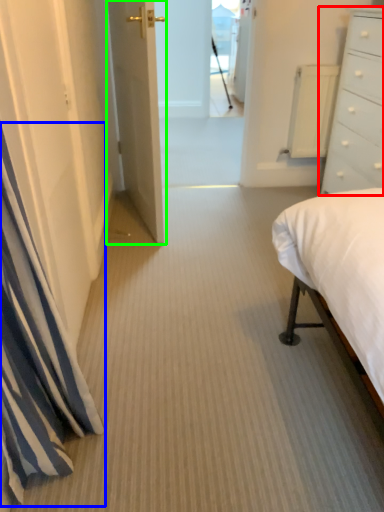
Question: Which object is the closest to the chest of drawers (highlighted by a red box)? Choose among these: curtain (highlighted by a blue box) or door (highlighted by a green box).

Choices:
 (A) curtain
 (B) door

Answer: (B)